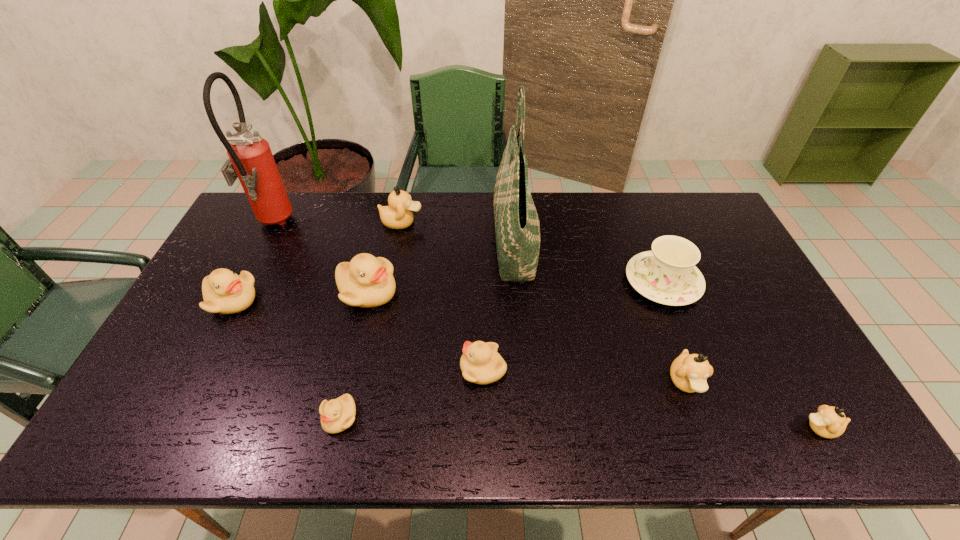
Locate an element on the screen. Image resolution: width=960 pixels, height=540 pixels. free location at the near edge of the desktop is located at coordinates (491, 450).

This screenshot has width=960, height=540. What are the coordinates of `free spot at the left edge of the desktop` in the screenshot? It's located at [188, 323].

You are a GUI agent. You are given a task and a screenshot of the screen. Output one action in this format:
    pyautogui.click(x=<x>, y=<y>)
    Task: Click on the free point between the fire extinguisher and the second tan duckling from left to right
    The image size is (960, 540).
    Given the screenshot: What is the action you would take?
    pyautogui.click(x=478, y=303)

This screenshot has width=960, height=540. Identify the location of free space between the tote bag and the second biggest tan duckling. (600, 312).

You are a GUI agent. You are given a task and a screenshot of the screen. Output one action in this format:
    pyautogui.click(x=<x>, y=<y>)
    Task: Click on the empty space that is in between the rightmost duckling and the chinaware
    The width and height of the screenshot is (960, 540).
    Given the screenshot: What is the action you would take?
    pyautogui.click(x=741, y=355)

The height and width of the screenshot is (540, 960). What are the coordinates of `empty location between the chinaware and the fire extinguisher` in the screenshot? It's located at (467, 253).

Find the location of `free space between the fire extinguisher and the farthest duckling`. free space between the fire extinguisher and the farthest duckling is located at coordinates (337, 224).

Where is `free area in between the smallest yellow duckling and the green tote bag`? Image resolution: width=960 pixels, height=540 pixels. free area in between the smallest yellow duckling and the green tote bag is located at coordinates [x=426, y=330].

Identify the location of vacant space that's between the rightmost tan duckling and the biggest yellow duckling. The height and width of the screenshot is (540, 960). (593, 360).

Find the location of a particular element. free point between the biggest tan duckling and the biggest yellow duckling is located at coordinates (385, 258).